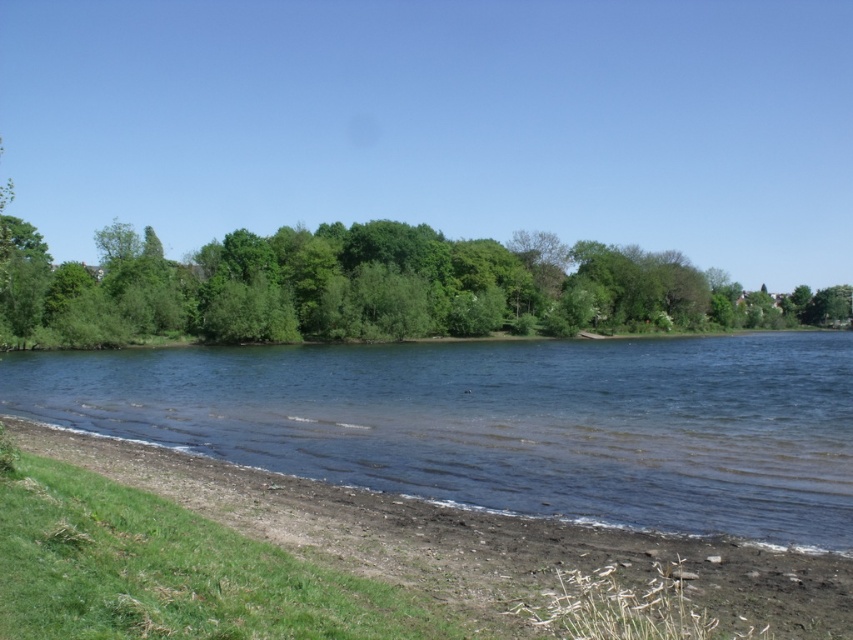
Question: Among these objects, which one is farthest from the camera?

Choices:
 (A) clear water at center
 (B) brown dirt at lower center
 (C) green leafy trees at center

Answer: (C)

Question: Can you confirm if clear water at center is bigger than green leafy trees at center?

Choices:
 (A) yes
 (B) no

Answer: (B)

Question: Does green leafy trees at center appear under brown dirt at lower center?

Choices:
 (A) no
 (B) yes

Answer: (A)

Question: Does green leafy trees at center appear on the right side of brown dirt at lower center?

Choices:
 (A) no
 (B) yes

Answer: (A)

Question: Which object is closer to the camera taking this photo?

Choices:
 (A) green leafy trees at center
 (B) clear water at center

Answer: (B)

Question: Which point is closer to the camera taking this photo?

Choices:
 (A) (289, 305)
 (B) (578, 426)

Answer: (B)